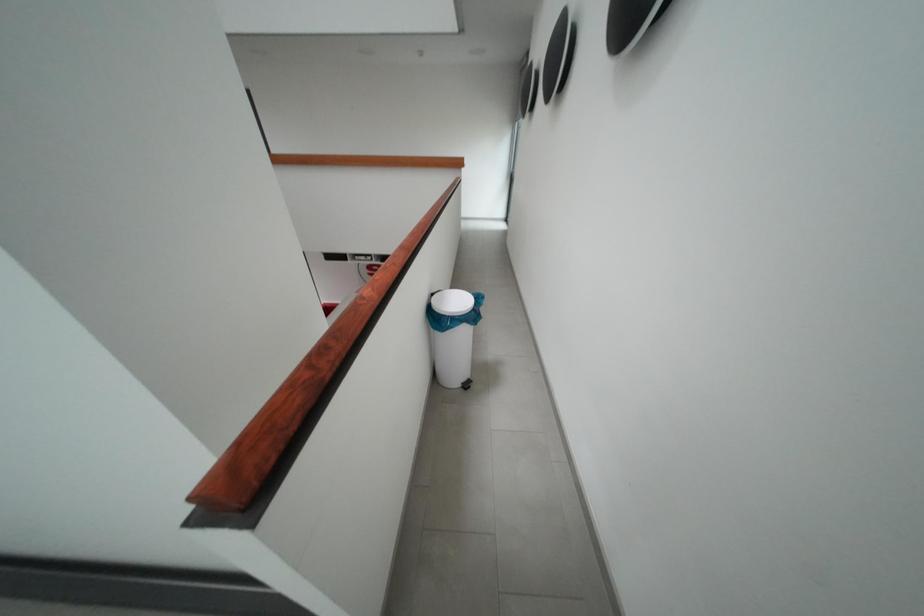
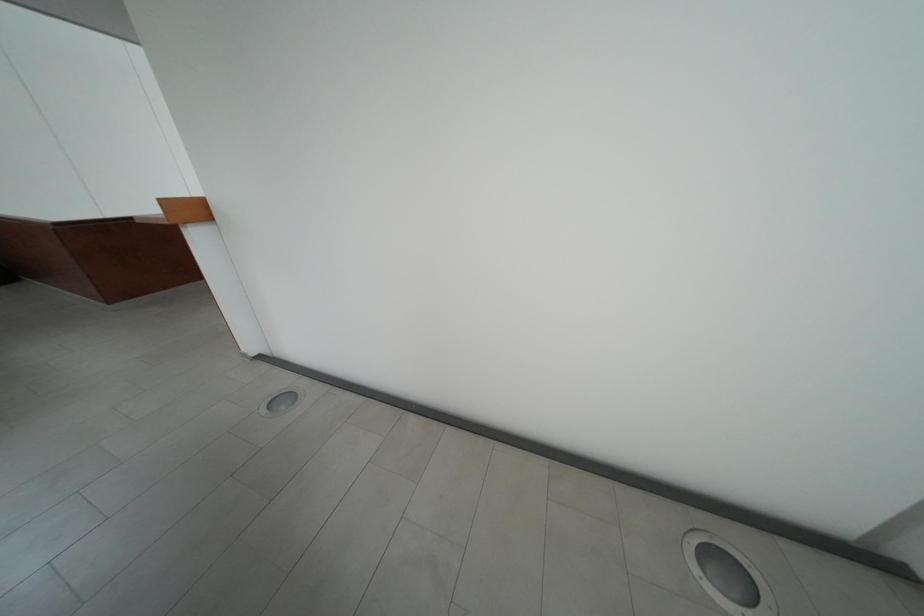
Question: What movement of the cameraman would produce the second image?

Choices:
 (A) Left
 (B) Right
 (C) Forward
 (D) Backward

Answer: (A)